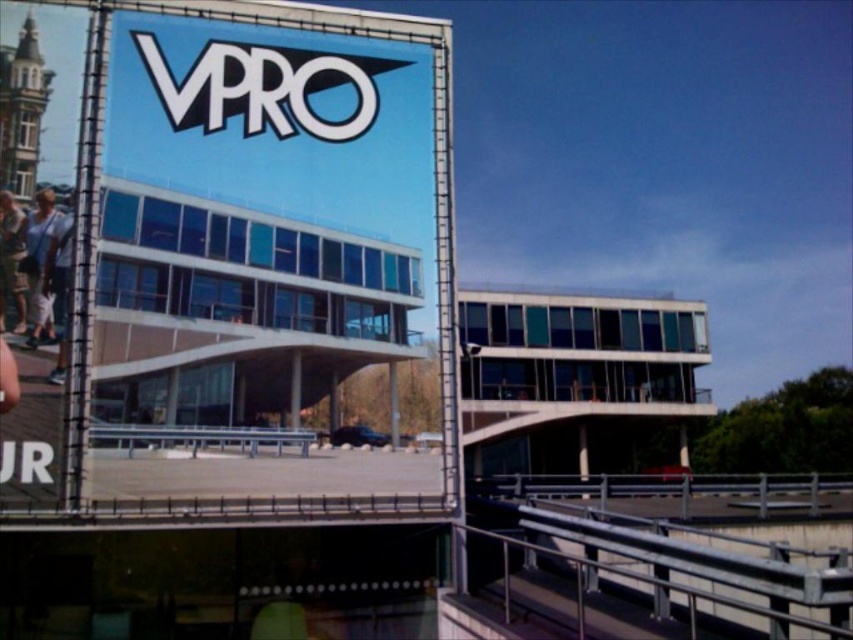
Does blue glossy sign at upper center appear over white glossy sign at upper center?

No, blue glossy sign at upper center is not above white glossy sign at upper center.

Which is behind, point (190, 72) or point (277, 116)?

Positioned behind is point (277, 116).

You are a GUI agent. You are given a task and a screenshot of the screen. Output one action in this format:
    pyautogui.click(x=<x>, y=<y>)
    Task: Click on the blue glossy sign at upper center
    Image resolution: width=853 pixels, height=640 pixels.
    Given the screenshot: What is the action you would take?
    pyautogui.click(x=259, y=212)